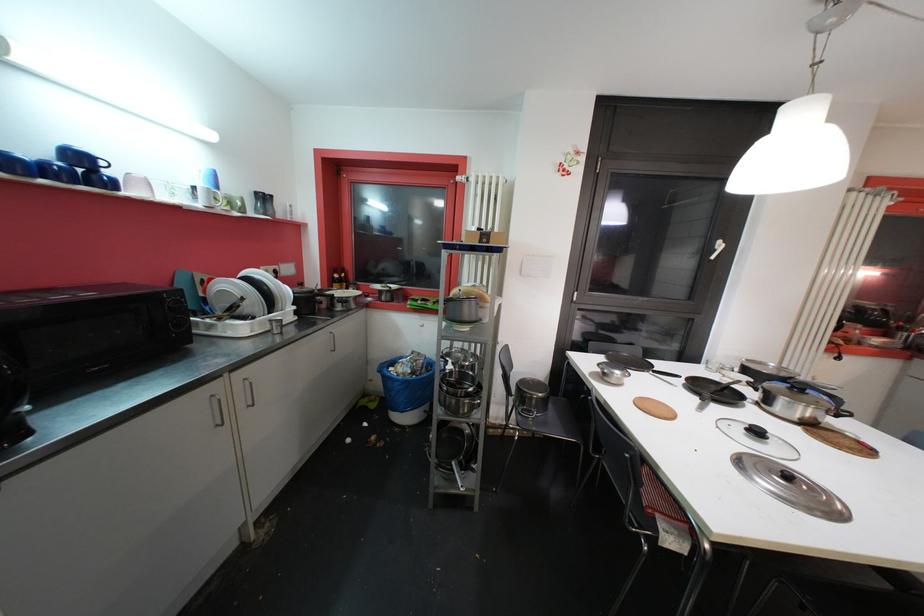
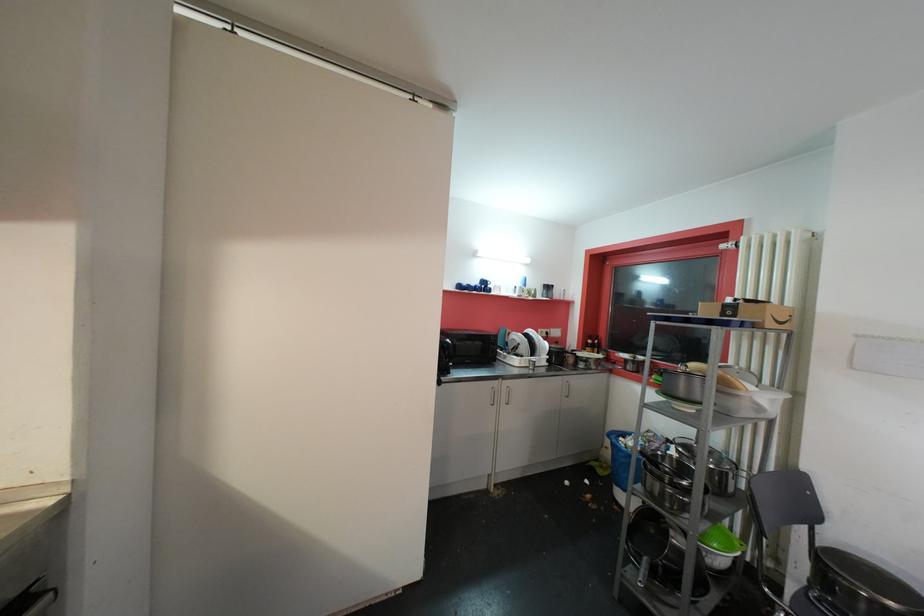
Locate, in the second image, the point that corresponds to point 335,284 in the first image.

(590, 347)